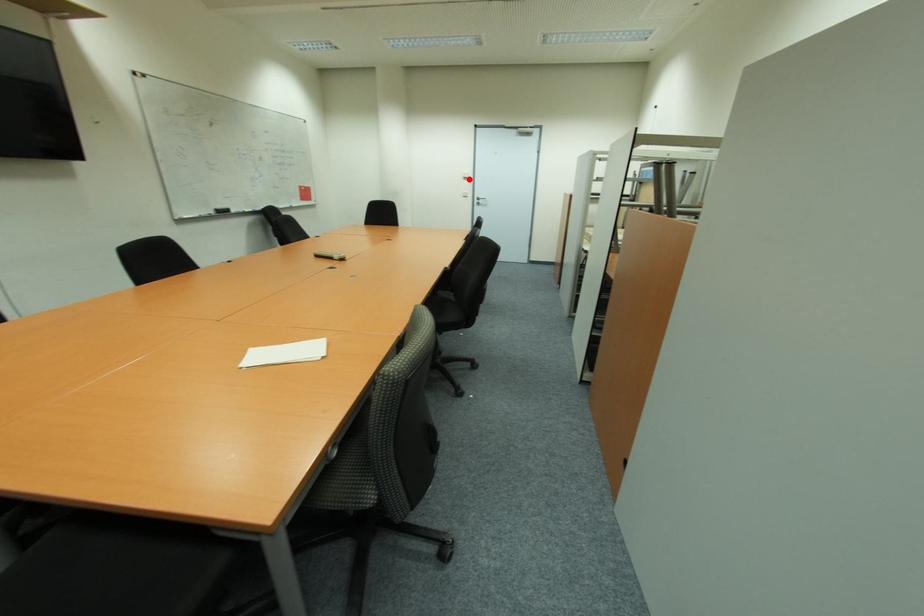
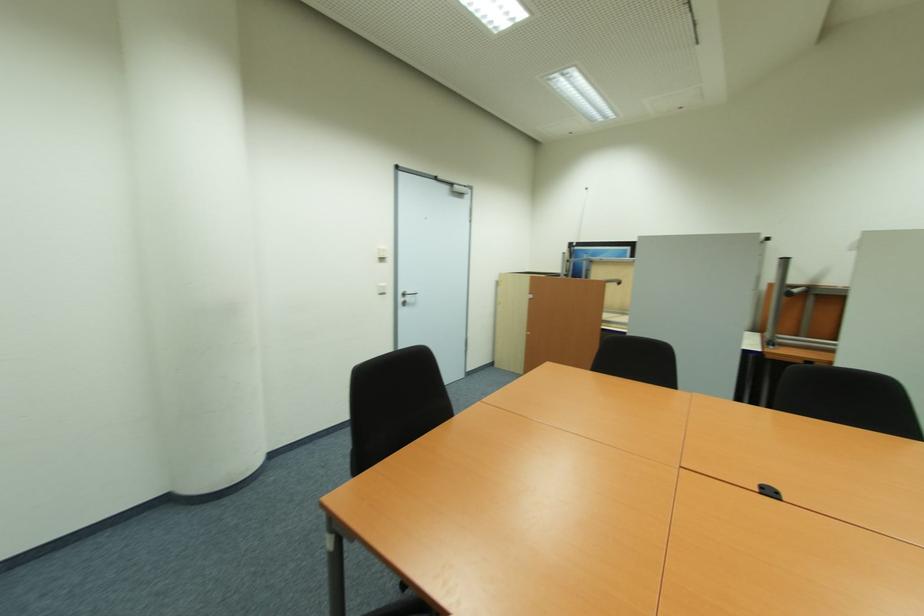
Question: I am providing you with two images of the same scene from different viewpoints. A red point is shown in image1. For the corresponding object point in image2, is it positioned nearer or farther from the camera?

Choices:
 (A) Nearer
 (B) Farther

Answer: (B)